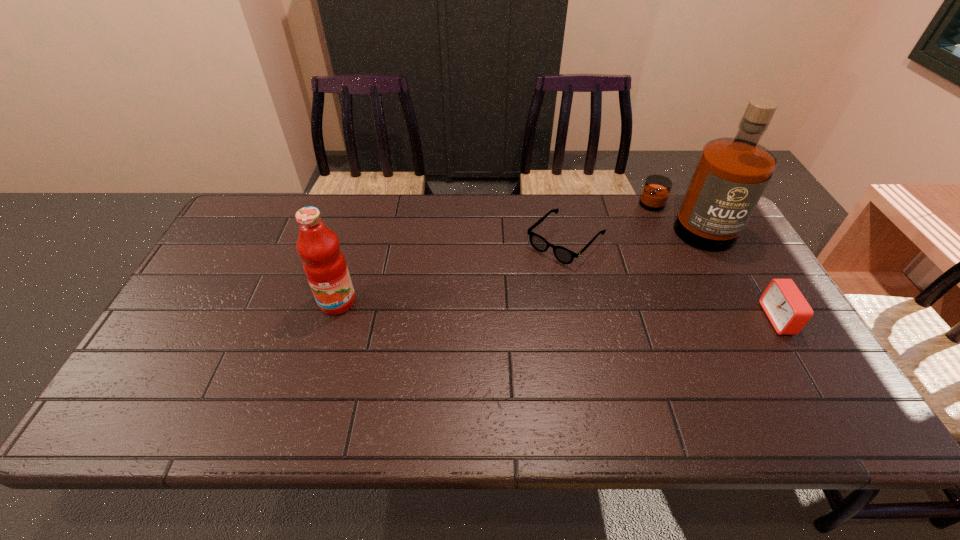
Where is `vacant region located 0.360m on the arms of the shortest object`? Image resolution: width=960 pixels, height=540 pixels. vacant region located 0.360m on the arms of the shortest object is located at coordinates (464, 342).

Find the location of a particular element. This screenshot has height=540, width=960. free spot located 0.070m on the arms of the shortest object is located at coordinates (530, 276).

Locate an element on the screen. vacant space located 0.310m on the arms of the shortest object is located at coordinates (476, 329).

At what (x,y) coordinates should I click in order to perform the action: click on free space located 0.290m on the front label of the tallest object. Please return your answer as a coordinate pair (x, y). Looking at the image, I should click on (619, 296).

In order to click on vacant space located on the front label of the tallest object in this screenshot , I will do `click(597, 319)`.

In order to click on vacant space positioned 0.290m on the front label of the tallest object in this screenshot , I will do `click(619, 296)`.

Find the location of `spectacles that is at the far edge`. spectacles that is at the far edge is located at coordinates (562, 254).

Identify the location of liquor that is at the far edge. (732, 173).

Locate an element on the screen. Image resolution: width=960 pixels, height=540 pixels. alarm clock situated at the right edge is located at coordinates (788, 311).

This screenshot has width=960, height=540. I want to click on liquor present at the right edge, so click(x=732, y=173).